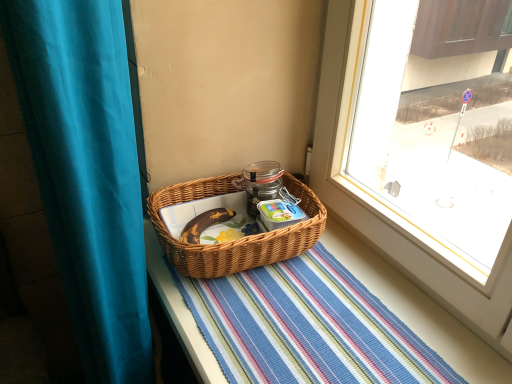
Question: Is woven brown picnic basket at center aimed at teal fabric curtain at left?

Choices:
 (A) no
 (B) yes

Answer: (B)

Question: From the image's perspective, is woven brown picnic basket at center on teal fabric curtain at left?

Choices:
 (A) no
 (B) yes

Answer: (B)

Question: Considering the relative sizes of woven brown picnic basket at center and teal fabric curtain at left in the image provided, is woven brown picnic basket at center thinner than teal fabric curtain at left?

Choices:
 (A) no
 (B) yes

Answer: (A)

Question: Considering the relative sizes of woven brown picnic basket at center and teal fabric curtain at left in the image provided, is woven brown picnic basket at center smaller than teal fabric curtain at left?

Choices:
 (A) yes
 (B) no

Answer: (A)

Question: Can you confirm if woven brown picnic basket at center is positioned to the right of teal fabric curtain at left?

Choices:
 (A) yes
 (B) no

Answer: (A)

Question: In the image, is woven brown picnic basket at center on the left side or the right side of striped woven mat at center?

Choices:
 (A) right
 (B) left

Answer: (B)

Question: Is woven brown picnic basket at center inside the boundaries of striped woven mat at center, or outside?

Choices:
 (A) inside
 (B) outside

Answer: (B)

Question: Considering their positions, is woven brown picnic basket at center located in front of or behind striped woven mat at center?

Choices:
 (A) behind
 (B) front

Answer: (A)

Question: From the image's perspective, is woven brown picnic basket at center positioned above or below striped woven mat at center?

Choices:
 (A) below
 (B) above

Answer: (B)

Question: Looking at their shapes, would you say teal fabric curtain at left is wider or thinner than striped woven mat at center?

Choices:
 (A) wide
 (B) thin

Answer: (B)

Question: From the image's perspective, is teal fabric curtain at left positioned above or below striped woven mat at center?

Choices:
 (A) above
 (B) below

Answer: (B)

Question: Considering their positions, is teal fabric curtain at left located in front of or behind striped woven mat at center?

Choices:
 (A) behind
 (B) front

Answer: (B)

Question: Is point (75, 180) closer or farther from the camera than point (407, 345)?

Choices:
 (A) closer
 (B) farther

Answer: (A)

Question: Relative to woven brown picnic basket at center, is teal fabric curtain at left in front or behind?

Choices:
 (A) front
 (B) behind

Answer: (A)

Question: Considering the positions of teal fabric curtain at left and woven brown picnic basket at center in the image, is teal fabric curtain at left wider or thinner than woven brown picnic basket at center?

Choices:
 (A) thin
 (B) wide

Answer: (A)